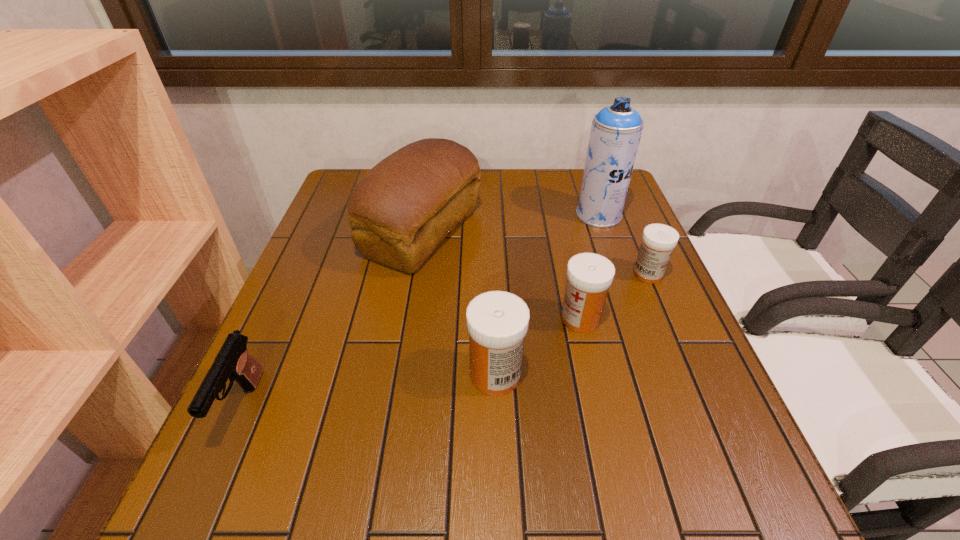
You are a GUI agent. You are given a task and a screenshot of the screen. Output one action in this format:
    pyautogui.click(x=<x>, y=<y>)
    Task: Click on the object that is at the far left corner
    
    Given the screenshot: What is the action you would take?
    pyautogui.click(x=400, y=210)

This screenshot has width=960, height=540. I want to click on object that is at the near left corner, so click(233, 361).

Locate an element on the screen. object that is at the far right corner is located at coordinates (616, 130).

In order to click on vacant area at the far edge of the desktop in this screenshot , I will do `click(516, 173)`.

What are the coordinates of `blank space at the left edge of the desktop` in the screenshot? It's located at (324, 296).

The width and height of the screenshot is (960, 540). Identify the location of free spot at the right edge of the desktop. (638, 360).

Locate an element on the screen. The image size is (960, 540). free space at the far left corner is located at coordinates (328, 202).

At what (x,y) coordinates should I click in order to perform the action: click on vacant region between the bread and the fourth object from left to right. Please return your answer as a coordinate pair (x, y). The image size is (960, 540). Looking at the image, I should click on (501, 275).

Find the location of a particular element. free spot between the shortest medicine and the aerosol can is located at coordinates (623, 245).

The width and height of the screenshot is (960, 540). Identify the location of free space between the leftmost object and the leftmost medicine. (369, 390).